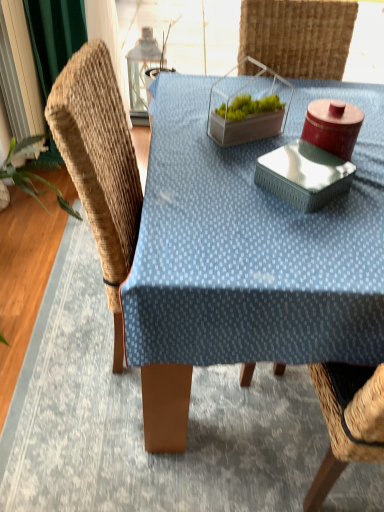
Where is `free point in front of woven wood swivel chair at left`? free point in front of woven wood swivel chair at left is located at coordinates (124, 464).